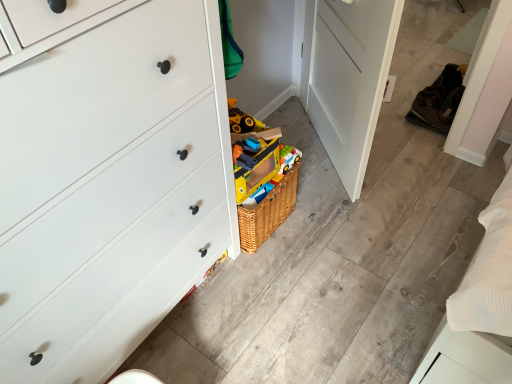
The image size is (512, 384). Describe the element at coordinates (429, 110) in the screenshot. I see `brown suede shoe at right, the first shoe in the left-to-right sequence` at that location.

Describe the element at coordinates (439, 100) in the screenshot. I see `brown leather shoe at right, the 2th shoe in the left-to-right sequence` at that location.

This screenshot has height=384, width=512. Identify the location of brown leather shoe at right, the 2th shoe in the left-to-right sequence. (439, 100).

The width and height of the screenshot is (512, 384). I want to click on brown suede shoe at right, the 2th shoe when ordered from right to left, so click(x=429, y=110).

In the image, is brown leather shoe at right, which appears as the first shoe when viewed from the right, positioned in front of or behind brown suede shoe at right, the first shoe in the left-to-right sequence?

In the image, brown leather shoe at right, which appears as the first shoe when viewed from the right, appears behind brown suede shoe at right, the first shoe in the left-to-right sequence.

Can you confirm if brown leather shoe at right, the 2th shoe in the left-to-right sequence, is positioned to the left of brown suede shoe at right, the 2th shoe when ordered from right to left?

No, brown leather shoe at right, the 2th shoe in the left-to-right sequence, is not to the left of brown suede shoe at right, the 2th shoe when ordered from right to left.

Considering the sizes of objects brown leather shoe at right, which appears as the first shoe when viewed from the right, and brown suede shoe at right, the 2th shoe when ordered from right to left, in the image provided, who is thinner, brown leather shoe at right, which appears as the first shoe when viewed from the right, or brown suede shoe at right, the 2th shoe when ordered from right to left,?

brown leather shoe at right, which appears as the first shoe when viewed from the right, is thinner.

Is point (440, 89) closer to camera compared to point (424, 103)?

No, (440, 89) is further to viewer.

From the picture: Which object is positioned more to the right, brown suede shoe at right, the 2th shoe when ordered from right to left, or white matte chest of drawers at left?

brown suede shoe at right, the 2th shoe when ordered from right to left, is more to the right.

From the image's perspective, is brown suede shoe at right, the first shoe in the left-to-right sequence, positioned above or below white matte chest of drawers at left?

brown suede shoe at right, the first shoe in the left-to-right sequence, is situated higher than white matte chest of drawers at left in the image.

Does point (440, 93) come behind point (217, 207)?

Yes.

From a real-world perspective, which is physically above, brown suede shoe at right, the 2th shoe when ordered from right to left, or white matte chest of drawers at left?

From a 3D spatial view, white matte chest of drawers at left is above.

Is white matte chest of drawers at left bigger than brown suede shoe at right, the 2th shoe when ordered from right to left?

Yes, white matte chest of drawers at left is bigger than brown suede shoe at right, the 2th shoe when ordered from right to left.

Is white matte chest of drawers at left not within brown suede shoe at right, the 2th shoe when ordered from right to left?

white matte chest of drawers at left lies outside brown suede shoe at right, the 2th shoe when ordered from right to left,'s area.

From a real-world perspective, which is physically below, white matte chest of drawers at left or brown suede shoe at right, the first shoe in the left-to-right sequence?

brown suede shoe at right, the first shoe in the left-to-right sequence.

Consider the image. Considering the relative positions of white matte chest of drawers at left and brown suede shoe at right, the 2th shoe when ordered from right to left, in the image provided, is white matte chest of drawers at left to the left of brown suede shoe at right, the 2th shoe when ordered from right to left, from the viewer's perspective?

Indeed, white matte chest of drawers at left is positioned on the left side of brown suede shoe at right, the 2th shoe when ordered from right to left.

Between white matte chest of drawers at left and brown leather shoe at right, the 2th shoe in the left-to-right sequence, which one is positioned in front?

white matte chest of drawers at left is more forward.

Which of these two, white matte chest of drawers at left or brown leather shoe at right, the 2th shoe in the left-to-right sequence, stands shorter?

brown leather shoe at right, the 2th shoe in the left-to-right sequence, is shorter.

Is white matte chest of drawers at left inside or outside of brown leather shoe at right, the 2th shoe in the left-to-right sequence?

white matte chest of drawers at left is located beyond the bounds of brown leather shoe at right, the 2th shoe in the left-to-right sequence.

Could you measure the distance between white matte chest of drawers at left and brown leather shoe at right, the 2th shoe in the left-to-right sequence?

white matte chest of drawers at left and brown leather shoe at right, the 2th shoe in the left-to-right sequence, are 5.64 feet apart from each other.

Considering the positions of objects brown leather shoe at right, the 2th shoe in the left-to-right sequence, and white matte chest of drawers at left in the image provided, who is more to the right, brown leather shoe at right, the 2th shoe in the left-to-right sequence, or white matte chest of drawers at left?

brown leather shoe at right, the 2th shoe in the left-to-right sequence.

Would you consider brown leather shoe at right, the 2th shoe in the left-to-right sequence, to be distant from white matte chest of drawers at left?

Yes, brown leather shoe at right, the 2th shoe in the left-to-right sequence, is far from white matte chest of drawers at left.

Who is smaller, brown leather shoe at right, the 2th shoe in the left-to-right sequence, or white matte chest of drawers at left?

With smaller size is brown leather shoe at right, the 2th shoe in the left-to-right sequence.

What's the angular difference between brown leather shoe at right, which appears as the first shoe when viewed from the right, and white matte chest of drawers at left's facing directions?

18.1 degrees separate the facing orientations of brown leather shoe at right, which appears as the first shoe when viewed from the right, and white matte chest of drawers at left.

In order to click on shoe above the brown suede shoe at right, the 2th shoe when ordered from right to left (from the image's perspective) in this screenshot , I will do `click(439, 100)`.

Considering the relative sizes of brown suede shoe at right, the first shoe in the left-to-right sequence, and brown leather shoe at right, which appears as the first shoe when viewed from the right, in the image provided, is brown suede shoe at right, the first shoe in the left-to-right sequence, thinner than brown leather shoe at right, which appears as the first shoe when viewed from the right,?

No, brown suede shoe at right, the first shoe in the left-to-right sequence, is not thinner than brown leather shoe at right, which appears as the first shoe when viewed from the right.

Between point (439, 131) and point (459, 82), which one is positioned behind?

The point (459, 82) is farther from the camera.

Based on the photo, is brown suede shoe at right, the 2th shoe when ordered from right to left, far from brown leather shoe at right, which appears as the first shoe when viewed from the right?

No, there isn't a large distance between brown suede shoe at right, the 2th shoe when ordered from right to left, and brown leather shoe at right, which appears as the first shoe when viewed from the right.

Locate an element on the screen. shoe that appears below the brown leather shoe at right, which appears as the first shoe when viewed from the right (from the image's perspective) is located at coordinates [x=429, y=110].

At what (x,y) coordinates should I click in order to perform the action: click on shoe that is the 1st one when counting upward from the white matte chest of drawers at left (from the image's perspective). Please return your answer as a coordinate pair (x, y). The height and width of the screenshot is (384, 512). Looking at the image, I should click on (429, 110).

Estimate the real-world distances between objects in this image. Which object is further from brown suede shoe at right, the 2th shoe when ordered from right to left, white matte chest of drawers at left or brown leather shoe at right, which appears as the first shoe when viewed from the right?

white matte chest of drawers at left is positioned further to the anchor brown suede shoe at right, the 2th shoe when ordered from right to left.

From the image, which object appears to be nearer to white matte chest of drawers at left, brown leather shoe at right, the 2th shoe in the left-to-right sequence, or brown suede shoe at right, the first shoe in the left-to-right sequence?

brown leather shoe at right, the 2th shoe in the left-to-right sequence, is closer to white matte chest of drawers at left.

Estimate the real-world distances between objects in this image. Which object is closer to brown suede shoe at right, the 2th shoe when ordered from right to left, brown leather shoe at right, which appears as the first shoe when viewed from the right, or white matte chest of drawers at left?

brown leather shoe at right, which appears as the first shoe when viewed from the right, lies closer to brown suede shoe at right, the 2th shoe when ordered from right to left, than the other object.

From the image, which object appears to be farther from brown leather shoe at right, which appears as the first shoe when viewed from the right, brown suede shoe at right, the 2th shoe when ordered from right to left, or white matte chest of drawers at left?

Based on the image, white matte chest of drawers at left appears to be further to brown leather shoe at right, which appears as the first shoe when viewed from the right.

Looking at the image, which one is located closer to brown leather shoe at right, the 2th shoe in the left-to-right sequence, white matte chest of drawers at left or brown suede shoe at right, the 2th shoe when ordered from right to left?

Based on the image, brown suede shoe at right, the 2th shoe when ordered from right to left, appears to be nearer to brown leather shoe at right, the 2th shoe in the left-to-right sequence.

Considering their positions, is brown suede shoe at right, the 2th shoe when ordered from right to left, positioned closer to white matte chest of drawers at left than brown leather shoe at right, the 2th shoe in the left-to-right sequence?

Based on the image, brown leather shoe at right, the 2th shoe in the left-to-right sequence, appears to be nearer to white matte chest of drawers at left.

The image size is (512, 384). In order to click on shoe between white matte chest of drawers at left and brown leather shoe at right, the 2th shoe in the left-to-right sequence, in the front-back direction in this screenshot , I will do `click(429, 110)`.